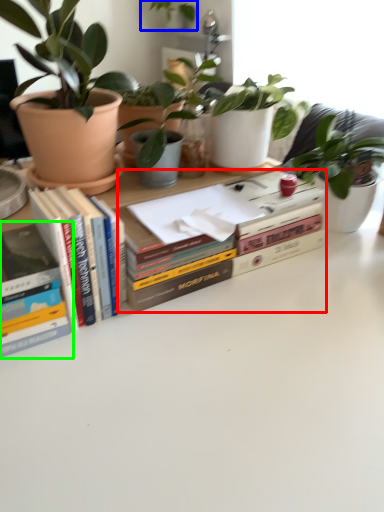
Question: Based on their relative distances, which object is farther from book (highlighted by a red box)? Choose from houseplant (highlighted by a blue box) and book (highlighted by a green box).

Choices:
 (A) houseplant
 (B) book

Answer: (A)